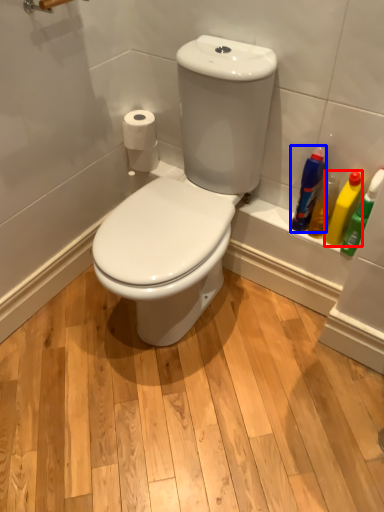
Question: Which point is further to the camera, cleaning product (highlighted by a red box) or cleaning product (highlighted by a blue box)?

Choices:
 (A) cleaning product
 (B) cleaning product

Answer: (B)